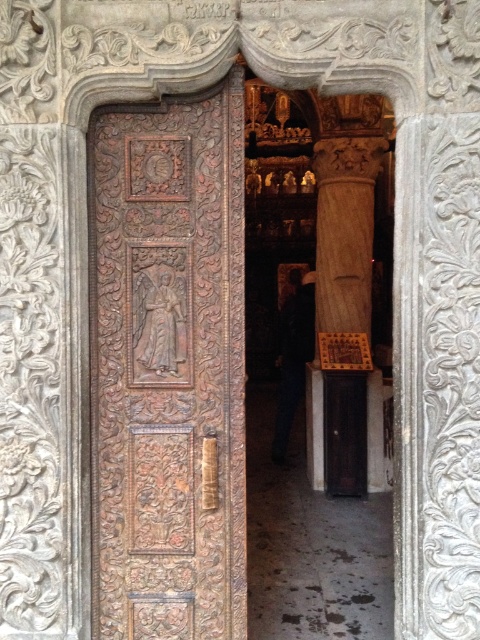
You are an architect assessing the structural integrity of the carved wood door at center and the smooth stone column at center. Which object is taller?

The carved wood door at center is much taller than the smooth stone column at center.

You are an architect visiting a historic site. You notice the carved wood door at center and the smooth stone column at center. Which object would require more space to fit through a standard doorway when moving it from the interior to the exterior? Please explain your reasoning based on their sizes.

The smooth stone column at center requires more space because it is larger than the carved wood door at center, as stated in the description. Since standard doorways have limited space, moving the larger column would necessitate more careful planning to ensure it fits through without damage.